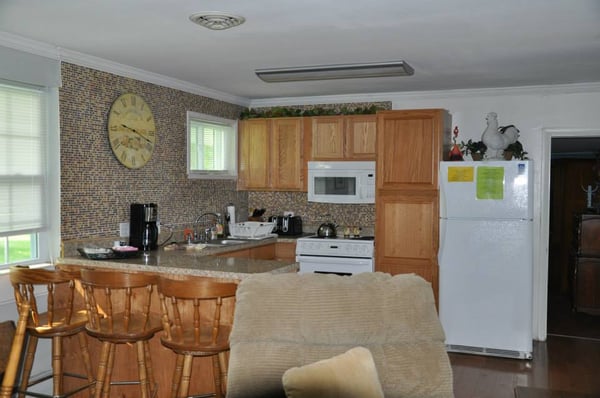
This screenshot has width=600, height=398. Identify the location of refrigerator. (474, 248).